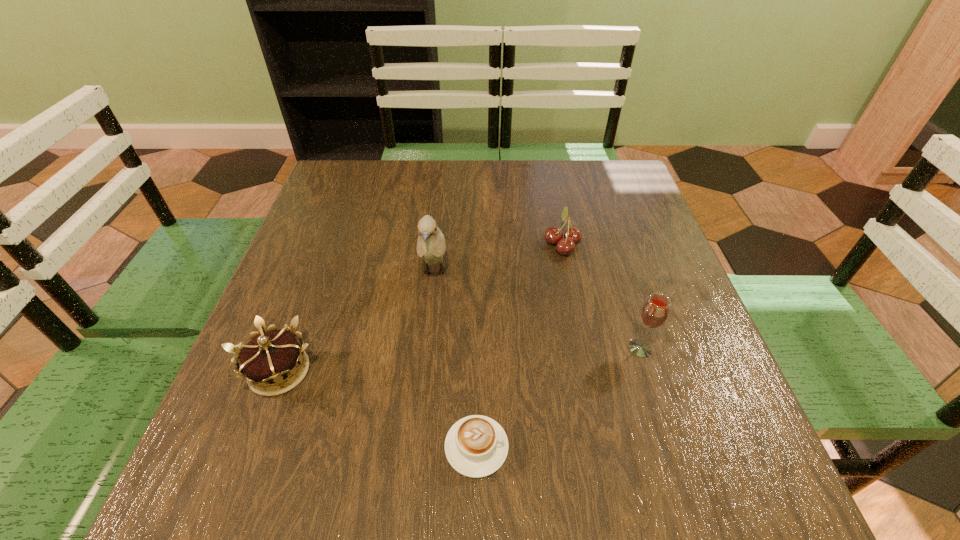
At what (x,y) coordinates should I click in order to perform the action: click on the tallest object. Please return your answer as a coordinate pair (x, y). The width and height of the screenshot is (960, 540). Looking at the image, I should click on (431, 245).

Image resolution: width=960 pixels, height=540 pixels. Identify the location of the second object from left to right. (431, 245).

The image size is (960, 540). Find the location of `the rightmost object`. the rightmost object is located at coordinates (655, 311).

At what (x,y) coordinates should I click in order to perform the action: click on the second tallest object. Please return your answer as a coordinate pair (x, y). This screenshot has width=960, height=540. Looking at the image, I should click on (655, 311).

Locate an element on the screen. Image resolution: width=960 pixels, height=540 pixels. the leftmost object is located at coordinates point(273,362).

Where is `the fourth object from left to right`? The width and height of the screenshot is (960, 540). the fourth object from left to right is located at coordinates (553, 235).

In order to click on cappuccino in this screenshot , I will do `click(476, 446)`.

Locate an element on the screen. The width and height of the screenshot is (960, 540). the shortest object is located at coordinates 476,446.

The width and height of the screenshot is (960, 540). What are the coordinates of `free space located at the beak of the tallest object` in the screenshot? It's located at (424, 370).

Locate an element on the screen. free space located on the left of the second tallest object is located at coordinates (458, 348).